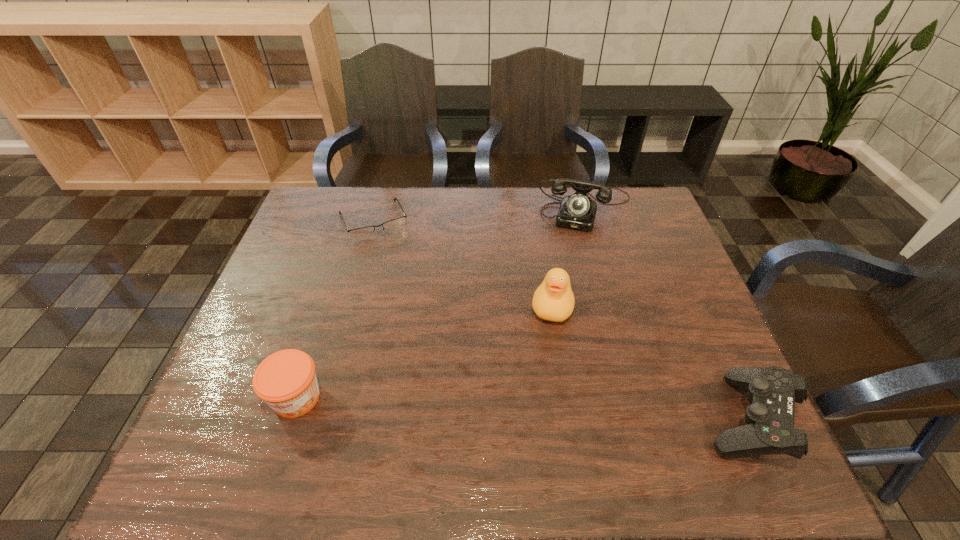
This screenshot has height=540, width=960. In order to click on empty space that is in between the jam and the duck in this screenshot , I will do `click(424, 351)`.

Find the location of a particular element. The image size is (960, 540). empty location between the jam and the tallest object is located at coordinates (424, 351).

At what (x,y) coordinates should I click in order to perform the action: click on vacant area between the spectacles and the tallest object. Please return your answer as a coordinate pair (x, y). The height and width of the screenshot is (540, 960). Looking at the image, I should click on (463, 263).

Locate an element on the screen. vacant space that's between the spectacles and the jam is located at coordinates (335, 309).

Locate an element on the screen. object that stands as the closest to the telephone is located at coordinates (553, 300).

Locate which object is the second closest to the control. Please provide its 2D coordinates. Your answer should be formatted as a tuple, i.e. [(x, y)], where the tuple contains the x and y coordinates of a point satisfying the conditions above.

[(577, 211)]